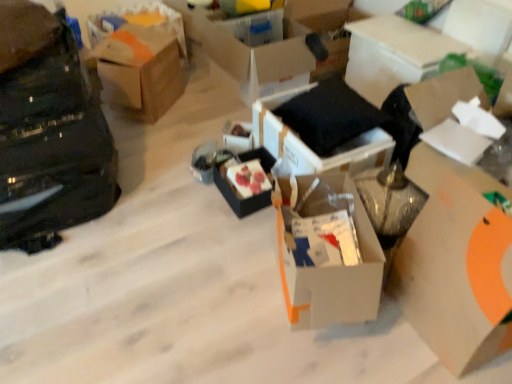
I want to click on vacant space to the left of black matte box at center, acting as the second box starting from the left, so click(x=191, y=199).